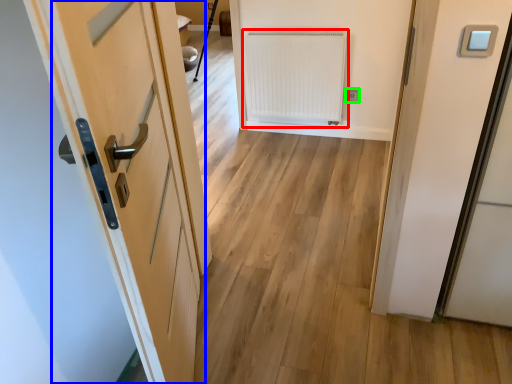
Question: Which is nearer to the radiator (highlighted by a red box)? door (highlighted by a blue box) or electric outlet (highlighted by a green box).

Choices:
 (A) door
 (B) electric outlet

Answer: (B)